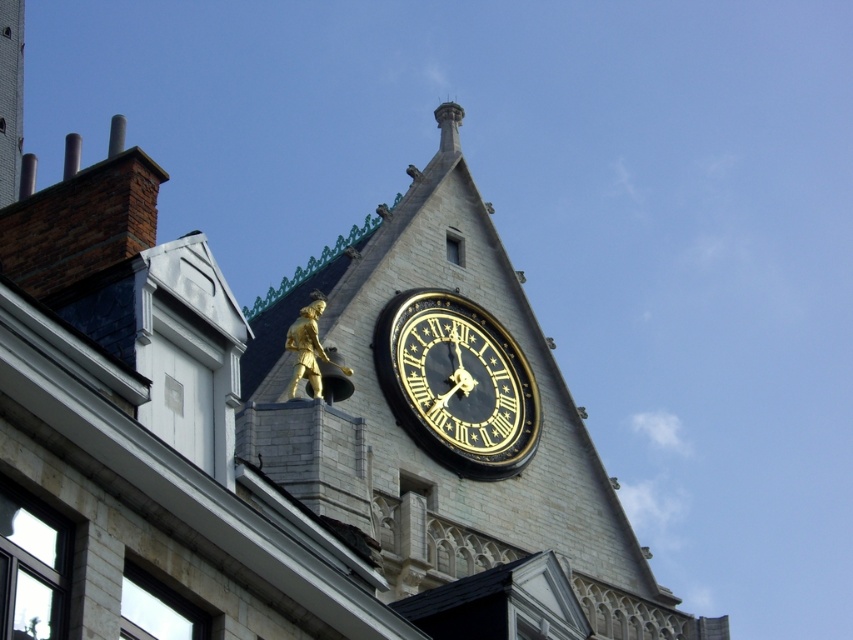
You are an architect examining the historic building. You notice the gold statue at upper center and the black polished clock at upper center. Which object is bigger in size?

The gold statue at upper center is larger in size compared to the black polished clock at upper center.